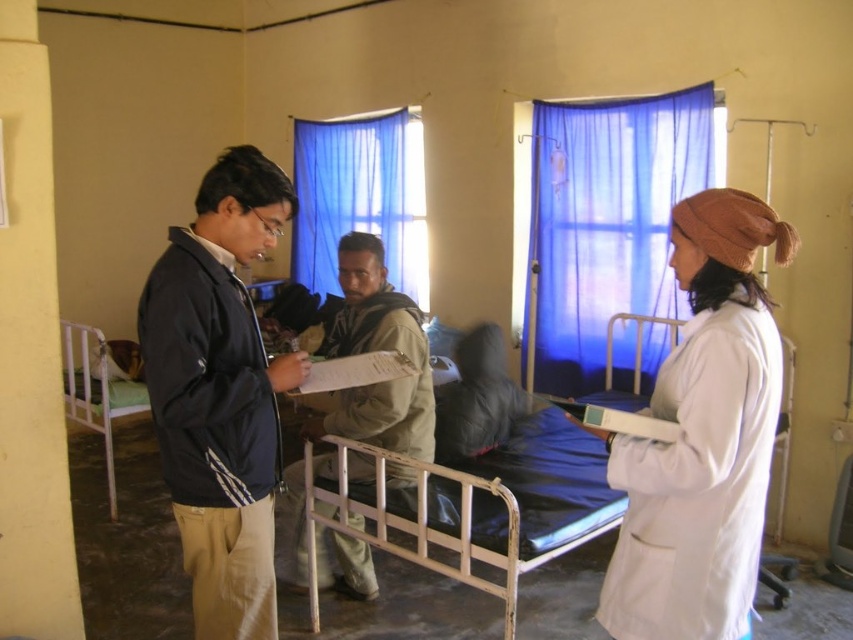
Does white matte lab coat at center lie behind khaki fabric jacket at center?

No.

Consider the image. Who is shorter, white matte lab coat at center or khaki fabric jacket at center?

white matte lab coat at center is shorter.

Is point (733, 417) closer to camera compared to point (410, 392)?

Yes, it is.

In order to click on white matte lab coat at center in this screenshot , I will do `click(701, 436)`.

Which of these two, metallic hospital bed at center or metallic hospital bed at left, stands taller?

metallic hospital bed at left

From the picture: Between metallic hospital bed at center and metallic hospital bed at left, which one appears on the left side from the viewer's perspective?

metallic hospital bed at left is more to the left.

The image size is (853, 640). What do you see at coordinates (498, 506) in the screenshot? I see `metallic hospital bed at center` at bounding box center [498, 506].

This screenshot has height=640, width=853. I want to click on metallic hospital bed at center, so [498, 506].

Does metallic hospital bed at center appear over khaki fabric jacket at center?

No.

Image resolution: width=853 pixels, height=640 pixels. I want to click on metallic hospital bed at center, so click(498, 506).